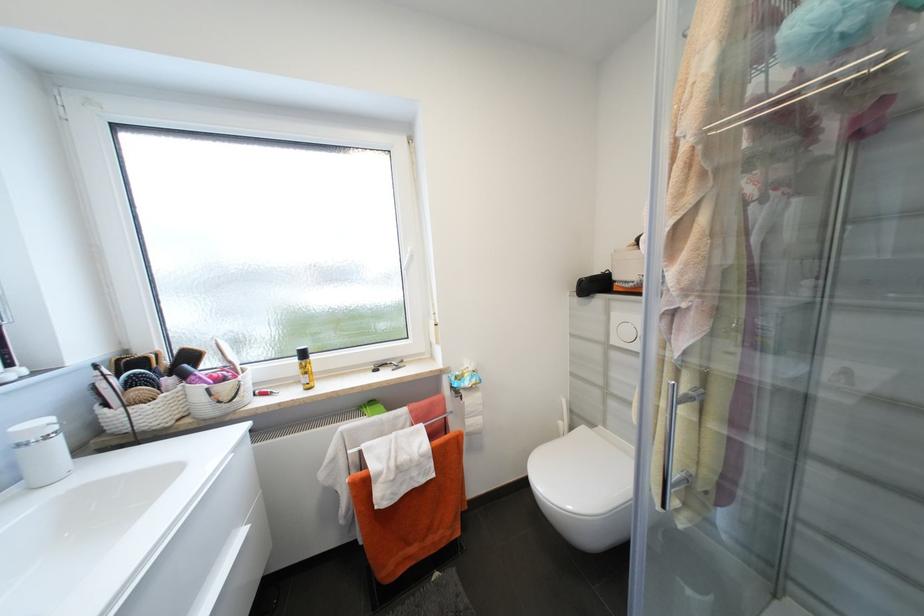
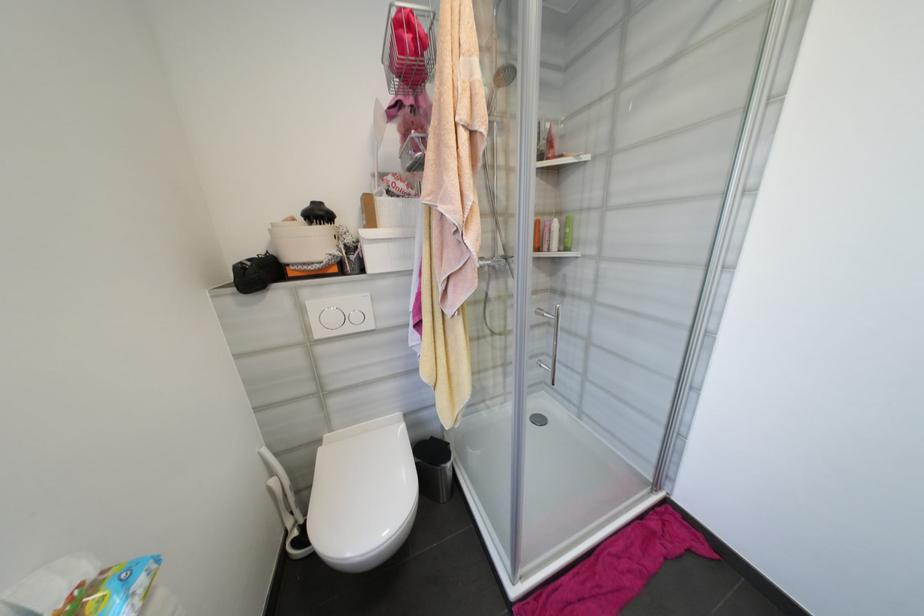
Question: The camera is either moving clockwise (left) or counter-clockwise (right) around the object. The first image is from the beginning of the video and the second image is from the end. Is the camera moving left or right when shooting the video?

Choices:
 (A) Left
 (B) Right

Answer: (A)